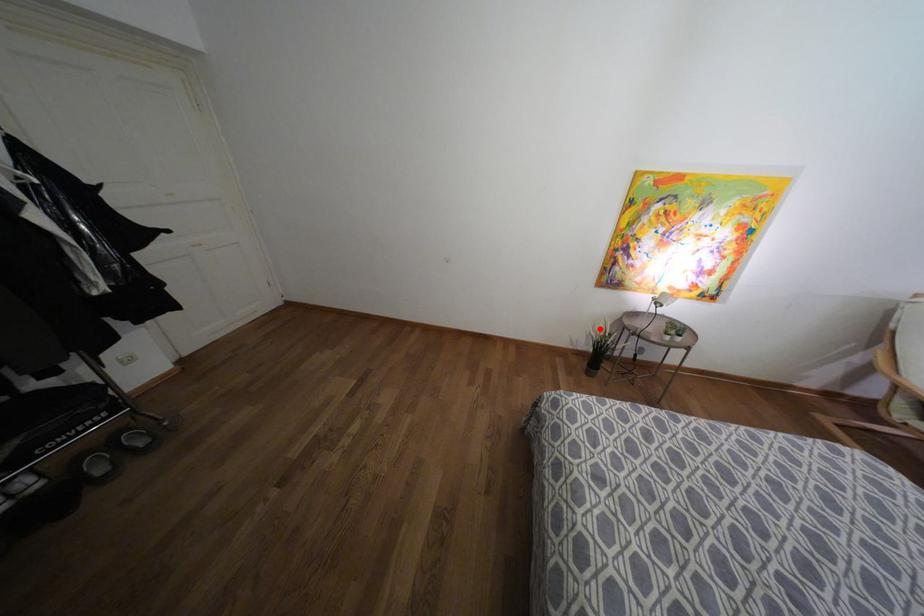
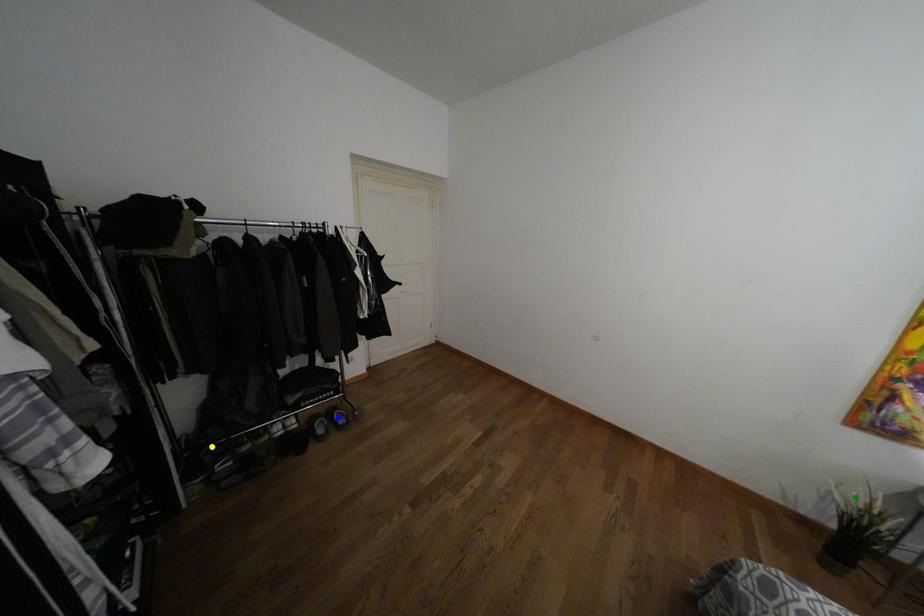
Question: I am providing you with two images of the same scene from different viewpoints. A red point is marked on the first image. You are given multiple points on the second image. Which mark in image 2 goes with the point in image 1?

Choices:
 (A) yellow point
 (B) green point
 (C) blue point

Answer: (B)